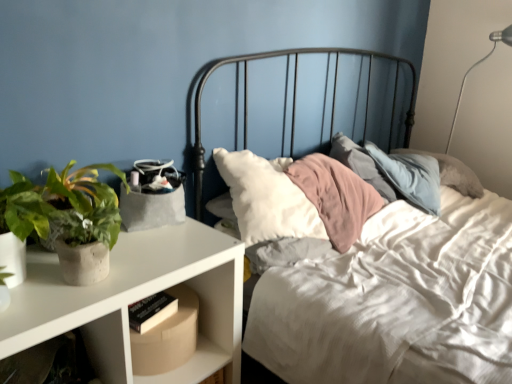
Question: Is cardboard box at lower left inside the boundaries of green matte plant at left, or outside?

Choices:
 (A) inside
 (B) outside

Answer: (B)

Question: Considering their positions, is cardboard box at lower left located in front of or behind green matte plant at left?

Choices:
 (A) behind
 (B) front

Answer: (A)

Question: Based on their relative distances, which object is farther from the white matte nightstand at left?

Choices:
 (A) green matte plant at left
 (B) cardboard box at lower left
 (C) metallic bed at center

Answer: (C)

Question: Estimate the real-world distances between objects in this image. Which object is closer to the green matte plant at left?

Choices:
 (A) metallic bed at center
 (B) white matte nightstand at left
 (C) cardboard box at lower left

Answer: (B)